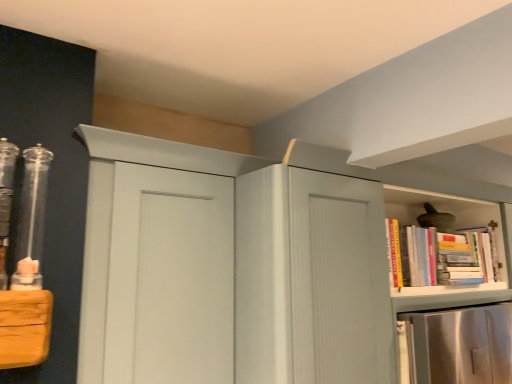
The width and height of the screenshot is (512, 384). Describe the element at coordinates (251, 266) in the screenshot. I see `matte white cupboard at center` at that location.

Find the location of a particular element. matte white cupboard at center is located at coordinates click(251, 266).

From the picture: What is the approximate height of hardcover books at right?

12.35 inches.

The image size is (512, 384). I want to click on hardcover books at right, so click(x=437, y=257).

What do you see at coordinates (437, 257) in the screenshot? I see `hardcover books at right` at bounding box center [437, 257].

You are a GUI agent. You are given a task and a screenshot of the screen. Output one action in this format:
    pyautogui.click(x=<x>, y=<y>)
    Task: Click on the matte white cupboard at center
    
    Given the screenshot: What is the action you would take?
    pyautogui.click(x=251, y=266)

Does matte white cupboard at center appear on the right side of hardcover books at right?

Incorrect, matte white cupboard at center is not on the right side of hardcover books at right.

Between matte white cupboard at center and hardcover books at right, which one is positioned in front?

Positioned in front is matte white cupboard at center.

Is point (134, 294) positioned in front of point (486, 247)?

Yes, point (134, 294) is in front of point (486, 247).

From the image's perspective, is matte white cupboard at center positioned above or below hardcover books at right?

matte white cupboard at center is situated lower than hardcover books at right in the image.

From a real-world perspective, is matte white cupboard at center physically below hardcover books at right?

Correct, in the physical world, matte white cupboard at center is lower than hardcover books at right.

Does matte white cupboard at center have a greater width compared to hardcover books at right?

Correct, the width of matte white cupboard at center exceeds that of hardcover books at right.

Is matte white cupboard at center shorter than hardcover books at right?

In fact, matte white cupboard at center may be taller than hardcover books at right.

Which of these two, matte white cupboard at center or hardcover books at right, is bigger?

Bigger between the two is matte white cupboard at center.

Would you say matte white cupboard at center contains hardcover books at right?

Indeed, hardcover books at right is located within matte white cupboard at center.

Is matte white cupboard at center far away from hardcover books at right?

No, there isn't a large distance between matte white cupboard at center and hardcover books at right.

Is matte white cupboard at center aimed at hardcover books at right?

Yes.

How different are the orientations of matte white cupboard at center and hardcover books at right in degrees?

The angle between the facing direction of matte white cupboard at center and the facing direction of hardcover books at right is 1.66 degrees.

The width and height of the screenshot is (512, 384). Find the location of `book lying behind the matte white cupboard at center`. book lying behind the matte white cupboard at center is located at coordinates (437, 257).

Which object is positioned more to the left, hardcover books at right or matte white cupboard at center?

matte white cupboard at center is more to the left.

Is hardcover books at right closer to the viewer compared to matte white cupboard at center?

No.

Does point (489, 251) come behind point (381, 266)?

Yes, point (489, 251) is behind point (381, 266).

From the image's perspective, between hardcover books at right and matte white cupboard at center, which one is located above?

hardcover books at right.

From a real-world perspective, is hardcover books at right on top of matte white cupboard at center?

Yes, from a real-world perspective, hardcover books at right is over matte white cupboard at center

In the scene shown: Looking at their sizes, would you say hardcover books at right is wider or thinner than matte white cupboard at center?

Clearly, hardcover books at right has less width compared to matte white cupboard at center.

Is hardcover books at right shorter than matte white cupboard at center?

Indeed, hardcover books at right has a lesser height compared to matte white cupboard at center.

Which of these two, hardcover books at right or matte white cupboard at center, is smaller?

hardcover books at right.

Which is correct: hardcover books at right is inside matte white cupboard at center, or outside of it?

The correct answer is: inside.

Is hardcover books at right positioned far away from matte white cupboard at center?

hardcover books at right is near matte white cupboard at center, not far away.

Could you tell me if hardcover books at right is facing matte white cupboard at center?

Yes, hardcover books at right faces towards matte white cupboard at center.

How distant is hardcover books at right from matte white cupboard at center?

hardcover books at right and matte white cupboard at center are 13.80 inches apart.

Where is `cupboard below the hardcover books at right (from the image's perspective)`? cupboard below the hardcover books at right (from the image's perspective) is located at coordinates (251, 266).

I want to click on book behind the matte white cupboard at center, so click(437, 257).

Image resolution: width=512 pixels, height=384 pixels. What are the coordinates of `cupboard that appears below the hardcover books at right (from the image's perspective)` in the screenshot? It's located at (251, 266).